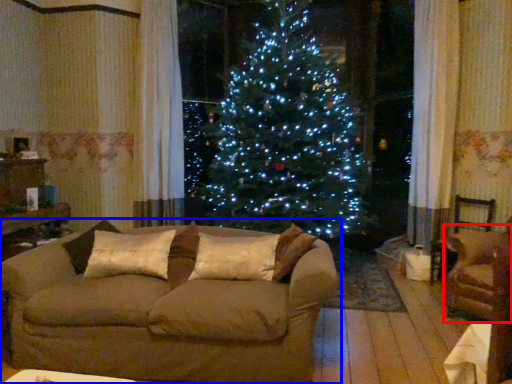
Question: Which point is closer to the camera, armchair (highlighted by a red box) or studio couch (highlighted by a blue box)?

Choices:
 (A) armchair
 (B) studio couch

Answer: (B)